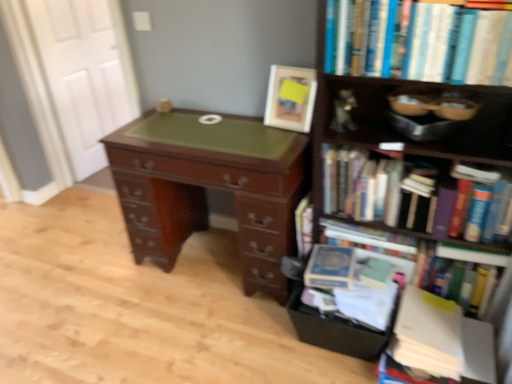
Locate an element on the screen. blank space situated above white paper stack at lower right, which appears as the 1th book when ordered from the bottom (from a real-world perspective) is located at coordinates (421, 315).